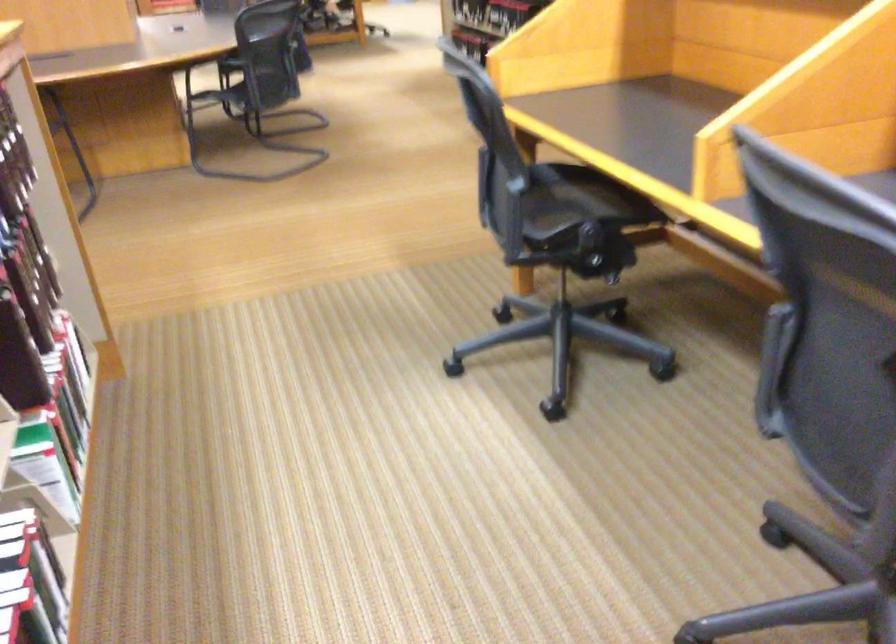
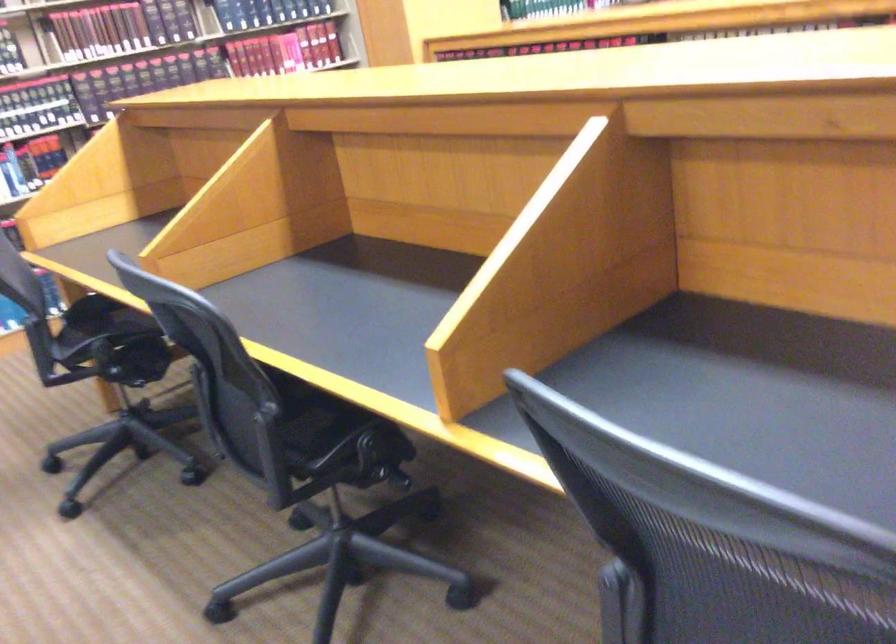
Question: I am providing you with two images of the same scene from different viewpoints. After the viewpoint changes to image2, which objects are now occluded?

Choices:
 (A) chair sitting surface
 (B) hardcover book
 (C) black chair sitting surface
 (D) white scratching post

Answer: (C)